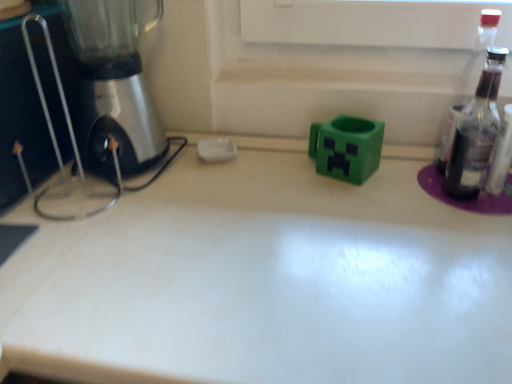
Where is `vacant space in front of green matte plastic mug at center`? This screenshot has width=512, height=384. vacant space in front of green matte plastic mug at center is located at coordinates (358, 221).